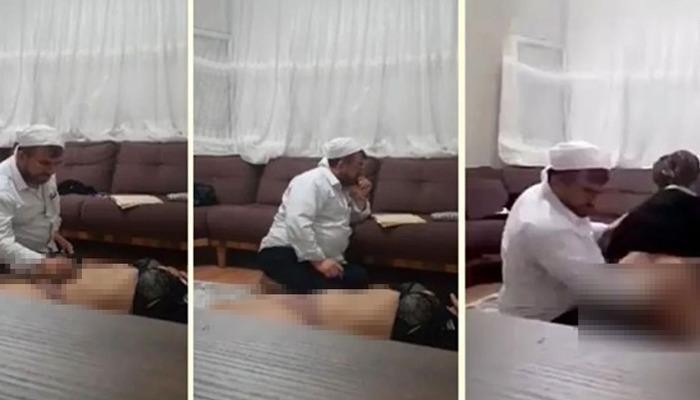
The height and width of the screenshot is (400, 700). I want to click on couch, so click(x=102, y=178), click(x=260, y=192), click(x=424, y=202), click(x=491, y=203), click(x=628, y=195).